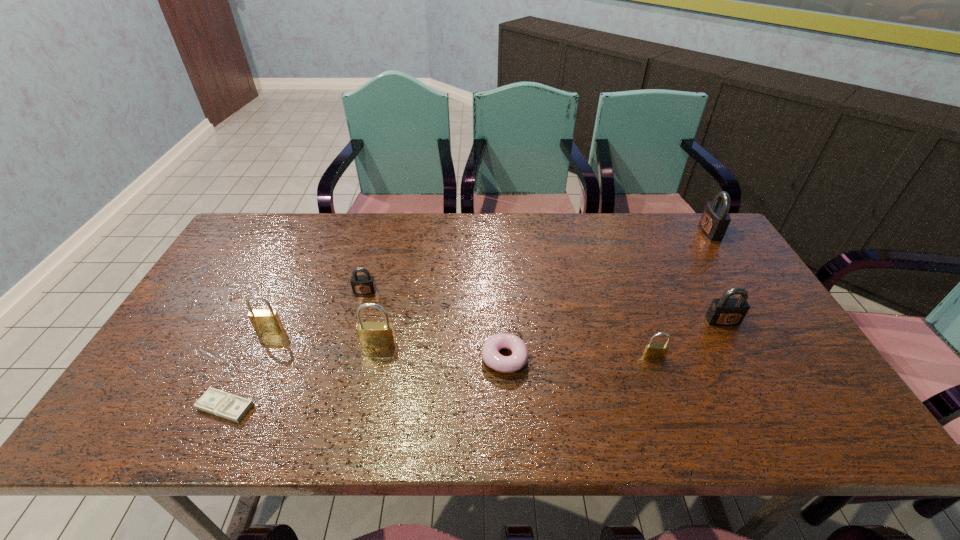
Where is `the farthest padlock`? the farthest padlock is located at coordinates (715, 219).

This screenshot has width=960, height=540. I want to click on the rightmost gray padlock, so click(715, 219).

In order to click on the second farthest brass padlock in this screenshot , I will do `click(372, 335)`.

Image resolution: width=960 pixels, height=540 pixels. Find the location of `the second nearest padlock`. the second nearest padlock is located at coordinates (372, 335).

At what (x,y) coordinates should I click in order to perform the action: click on the second smallest gray padlock. Please return your answer as a coordinate pair (x, y). Looking at the image, I should click on (725, 311).

Locate an element on the screen. The width and height of the screenshot is (960, 540). the second gray padlock from right to left is located at coordinates (725, 311).

You are a GUI agent. You are given a task and a screenshot of the screen. Output one action in this format:
    pyautogui.click(x=<x>, y=<y>)
    Task: Click on the farthest brass padlock
    The image size is (960, 540).
    Given the screenshot: What is the action you would take?
    pyautogui.click(x=262, y=320)

You are a GUI agent. You are given a task and a screenshot of the screen. Output one action in this format:
    pyautogui.click(x=<x>, y=<y>)
    Task: Click on the leftmost padlock
    
    Given the screenshot: What is the action you would take?
    pyautogui.click(x=262, y=320)

The height and width of the screenshot is (540, 960). What are the coordinates of `the second nearest gray padlock` in the screenshot? It's located at (365, 284).

Locate an element on the screen. Image resolution: width=960 pixels, height=540 pixels. the fifth nearest padlock is located at coordinates (365, 284).